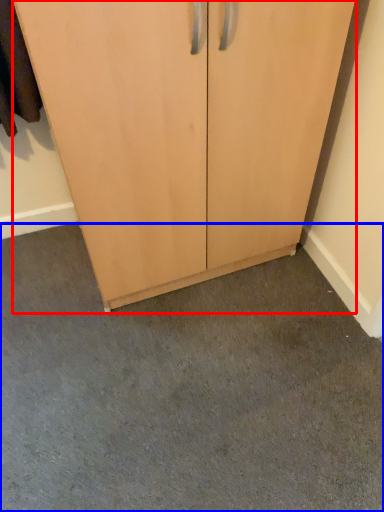
Question: Which point is closer to the camera, cupboard (highlighted by a red box) or concrete (highlighted by a blue box)?

Choices:
 (A) cupboard
 (B) concrete

Answer: (A)